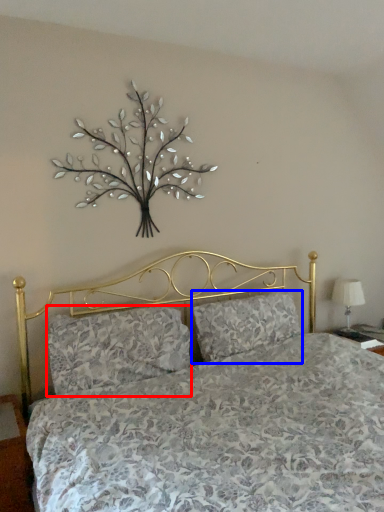
Question: Which point is further to the camera, pillow (highlighted by a red box) or pillow (highlighted by a blue box)?

Choices:
 (A) pillow
 (B) pillow

Answer: (B)